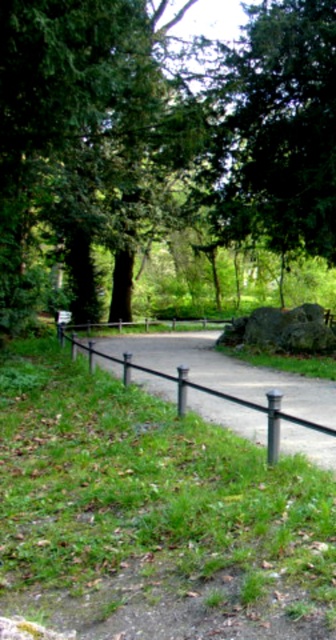
You are a park visitor standing on the paved pathway and see the green leafy tree at center and the black metal pole at center. Which object is located to the left of the other?

The green leafy tree at center is positioned on the left side of black metal pole at center.

You are a gardener planning to place a new bench between the green leafy tree at center and the green metallic pole at center. Which object should the bench be closer to to ensure it doesn

The green leafy tree at center is wider than the green metallic pole at center, so the bench should be placed closer to the green metallic pole at center to ensure it doesn

You are standing on the paved pathway in the park and see two points marked on the ground. The first point is at coordinates point (261,179) and the second is at point (179,365). Which point is closer to you?

Point (179,365) is closer to you because it is less further to the camera than point (261,179).